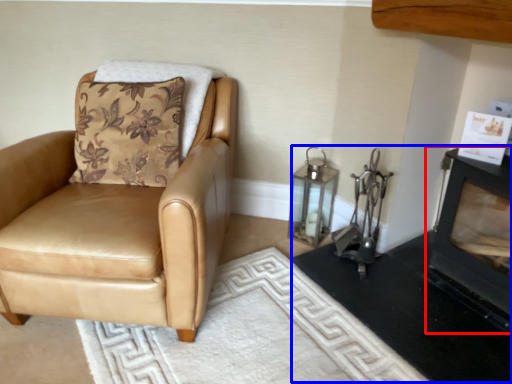
Question: Which object is further to the camera taking this photo, fireplace (highlighted by a red box) or fireplace (highlighted by a blue box)?

Choices:
 (A) fireplace
 (B) fireplace

Answer: (B)